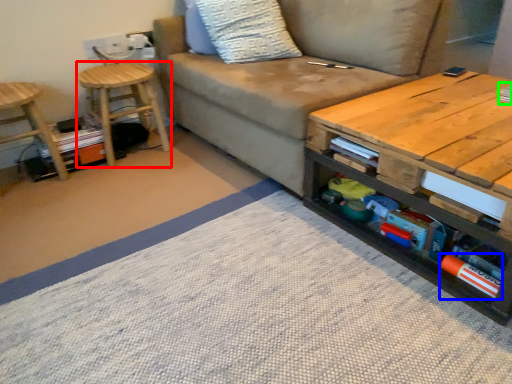
Question: Considering the real-world distances, which object is farthest from stool (highlighted by a red box)? book (highlighted by a blue box) or book (highlighted by a green box)?

Choices:
 (A) book
 (B) book

Answer: (B)